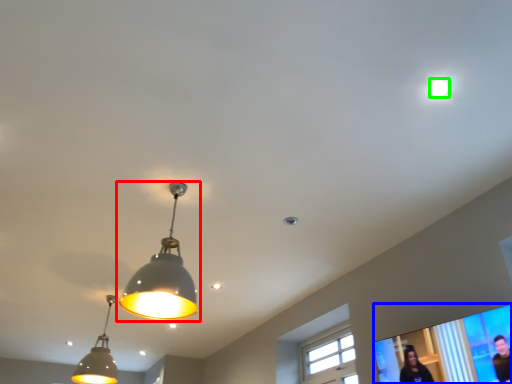
Question: Which object is positioned farthest from lamp (highlighted by a red box)? Select from projection screen (highlighted by a blue box) and droplight (highlighted by a green box).

Choices:
 (A) projection screen
 (B) droplight

Answer: (B)